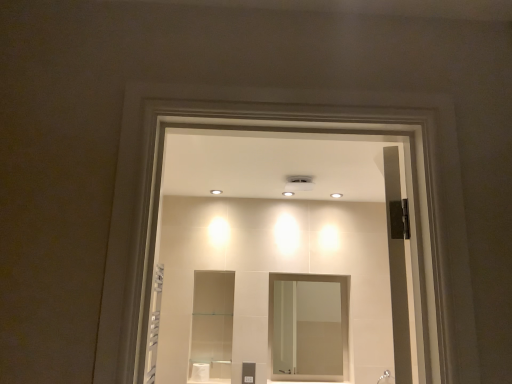
Question: From the image's perspective, is clear glass mirror at center above or below white glossy shower head at lower right?

Choices:
 (A) above
 (B) below

Answer: (A)

Question: Is clear glass mirror at center inside or outside of white glossy shower head at lower right?

Choices:
 (A) inside
 (B) outside

Answer: (B)

Question: Considering the relative positions of clear glass mirror at center and white glossy shower head at lower right in the image provided, is clear glass mirror at center to the left or to the right of white glossy shower head at lower right?

Choices:
 (A) right
 (B) left

Answer: (B)

Question: Considering the positions of white glossy shower head at lower right and clear glass mirror at center in the image, is white glossy shower head at lower right taller or shorter than clear glass mirror at center?

Choices:
 (A) short
 (B) tall

Answer: (A)

Question: In terms of width, does white glossy shower head at lower right look wider or thinner when compared to clear glass mirror at center?

Choices:
 (A) thin
 (B) wide

Answer: (B)

Question: Visually, is white glossy shower head at lower right positioned to the left or to the right of clear glass mirror at center?

Choices:
 (A) left
 (B) right

Answer: (B)

Question: In the image, is white glossy shower head at lower right positioned in front of or behind clear glass mirror at center?

Choices:
 (A) behind
 (B) front

Answer: (B)